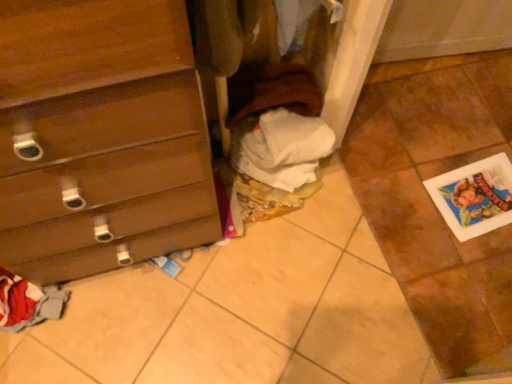
Question: Is there a large distance between brown cotton sweater at center and white paper at lower right?

Choices:
 (A) no
 (B) yes

Answer: (A)

Question: Can you confirm if brown cotton sweater at center is wider than white paper at lower right?

Choices:
 (A) no
 (B) yes

Answer: (A)

Question: Considering the relative positions of brown cotton sweater at center and white paper at lower right in the image provided, is brown cotton sweater at center in front of white paper at lower right?

Choices:
 (A) yes
 (B) no

Answer: (A)

Question: Is brown cotton sweater at center to the right of white paper at lower right from the viewer's perspective?

Choices:
 (A) yes
 (B) no

Answer: (B)

Question: From the image's perspective, is brown cotton sweater at center on top of white paper at lower right?

Choices:
 (A) no
 (B) yes

Answer: (B)

Question: In terms of width, does wooden chest of drawers at left look wider or thinner when compared to white paper at lower right?

Choices:
 (A) wide
 (B) thin

Answer: (A)

Question: From their relative heights in the image, would you say wooden chest of drawers at left is taller or shorter than white paper at lower right?

Choices:
 (A) tall
 (B) short

Answer: (A)

Question: Considering the positions of wooden chest of drawers at left and white paper at lower right in the image, is wooden chest of drawers at left bigger or smaller than white paper at lower right?

Choices:
 (A) big
 (B) small

Answer: (A)

Question: Considering the relative positions of wooden chest of drawers at left and white paper at lower right in the image provided, is wooden chest of drawers at left to the left or to the right of white paper at lower right?

Choices:
 (A) left
 (B) right

Answer: (A)

Question: Considering their positions, is white paper at lower right located in front of or behind brown cotton sweater at center?

Choices:
 (A) front
 (B) behind

Answer: (B)

Question: Looking at the image, does white paper at lower right seem bigger or smaller compared to brown cotton sweater at center?

Choices:
 (A) small
 (B) big

Answer: (A)

Question: Considering the positions of point (482, 172) and point (265, 107), is point (482, 172) closer or farther from the camera than point (265, 107)?

Choices:
 (A) closer
 (B) farther

Answer: (B)

Question: Is white paper at lower right to the left or to the right of brown cotton sweater at center in the image?

Choices:
 (A) left
 (B) right

Answer: (B)

Question: Is wooden chest of drawers at left spatially inside brown cotton sweater at center, or outside of it?

Choices:
 (A) inside
 (B) outside

Answer: (B)

Question: From their relative heights in the image, would you say wooden chest of drawers at left is taller or shorter than brown cotton sweater at center?

Choices:
 (A) short
 (B) tall

Answer: (B)